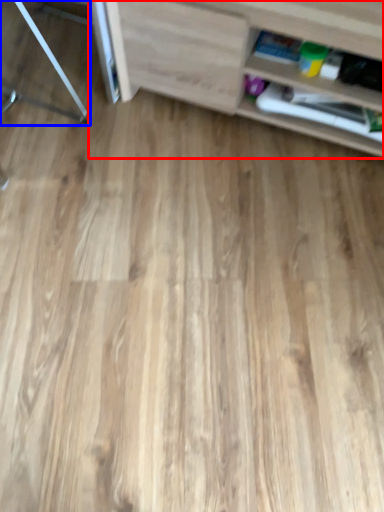
Question: Which object appears farthest to the camera in this image, shelf (highlighted by a red box) or furniture (highlighted by a blue box)?

Choices:
 (A) shelf
 (B) furniture

Answer: (B)